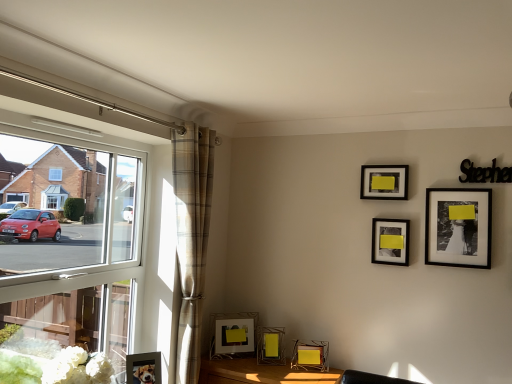
Question: In terms of width, does matte glass picture frame at lower center, marked as the 6th picture frame in a right-to-left arrangement, look wider or thinner when compared to plaid fabric curtain at left?

Choices:
 (A) thin
 (B) wide

Answer: (A)

Question: From a real-world perspective, is matte glass picture frame at lower center, marked as the 6th picture frame in a right-to-left arrangement, positioned above or below plaid fabric curtain at left?

Choices:
 (A) below
 (B) above

Answer: (A)

Question: Estimate the real-world distances between objects in this image. Which object is closer to the metallic silver picture frame at lower left, positioned as the first picture frame in left-to-right order?

Choices:
 (A) matte black picture frame at center, the sixth picture frame in the left-to-right sequence
 (B) clear glass window at left
 (C) metallic gold table at lower center
 (D) matte glass picture frame at lower center, marked as the 6th picture frame in a right-to-left arrangement
 (E) plaid fabric curtain at left

Answer: (E)

Question: Estimate the real-world distances between objects in this image. Which object is farther from the matte black picture frame at center, which is the 2th picture frame from right to left?

Choices:
 (A) metallic gold table at lower center
 (B) plaid fabric curtain at left
 (C) white matte floral arrangement at lower left
 (D) metallic wireframe picture frame at lower center, which is the fourth picture frame in left-to-right order
 (E) matte black picture frame at upper right, the fifth picture frame in the left-to-right sequence

Answer: (C)